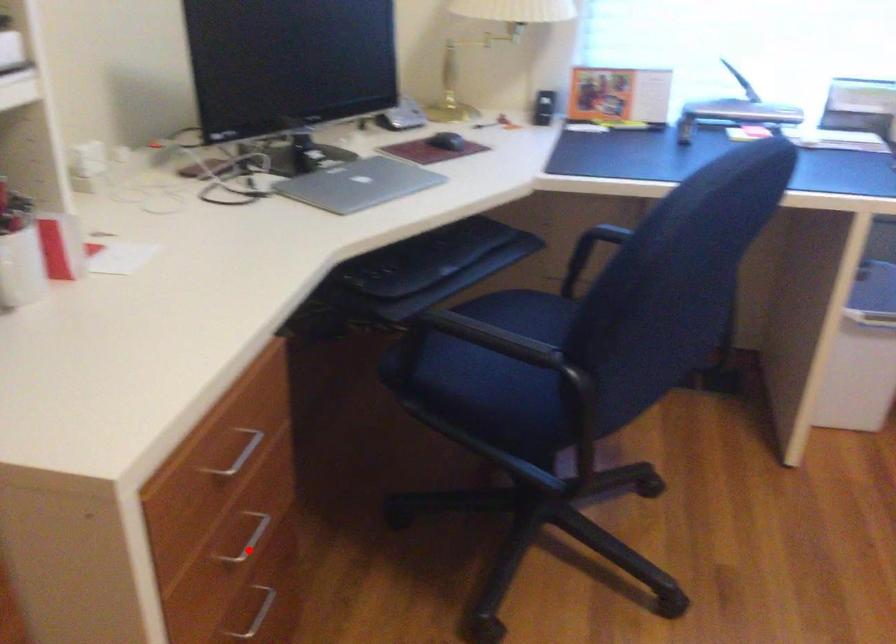
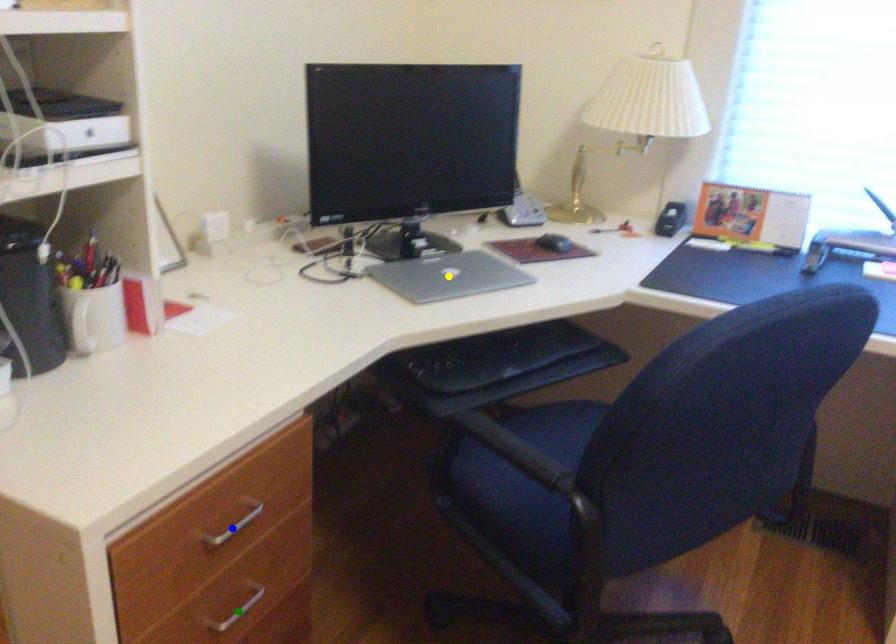
Question: I am providing you with two images of the same scene from different viewpoints. A red point is marked on the first image. You are given multiple points on the second image. Which point in image 2 is actually the same real-world point as the red point in image 1?

Choices:
 (A) green point
 (B) yellow point
 (C) blue point

Answer: (A)